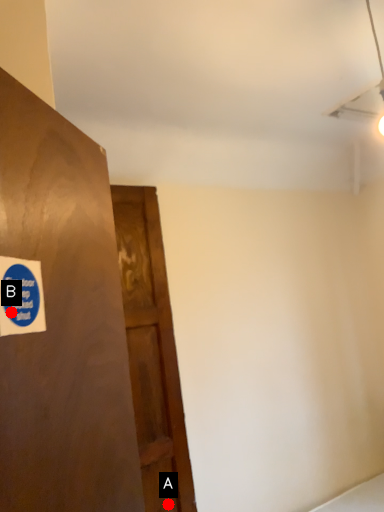
Question: Two points are circled on the image, labeled by A and B beside each circle. Which point appears closest to the camera in this image?

Choices:
 (A) A is closer
 (B) B is closer

Answer: (B)